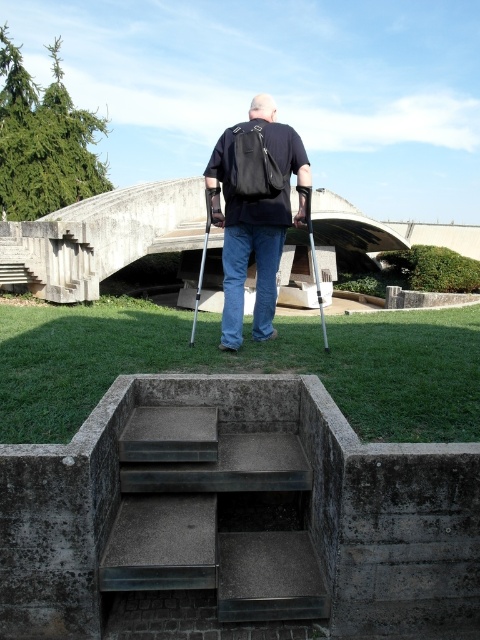
Does black matte backpack at center appear over metallic silver crutch at center?

No, black matte backpack at center is not above metallic silver crutch at center.

Find the location of a particular element. black matte backpack at center is located at coordinates (253, 214).

Identify the location of black matte backpack at center. Image resolution: width=480 pixels, height=640 pixels. (253, 214).

Between metallic silver crutch at center and silver metallic crutch at center, which one appears on the right side from the viewer's perspective?

From the viewer's perspective, metallic silver crutch at center appears more on the right side.

Between metallic silver crutch at center and silver metallic crutch at center, which one has less height?

metallic silver crutch at center is shorter.

Identify the location of metallic silver crutch at center. The width and height of the screenshot is (480, 640). [313, 256].

Does point (247, 209) lie behind point (206, 218)?

That is False.

Find the location of `black matte backpack at center`. black matte backpack at center is located at coordinates (253, 214).

This screenshot has width=480, height=640. Find the location of `black matte backpack at center`. black matte backpack at center is located at coordinates (253, 214).